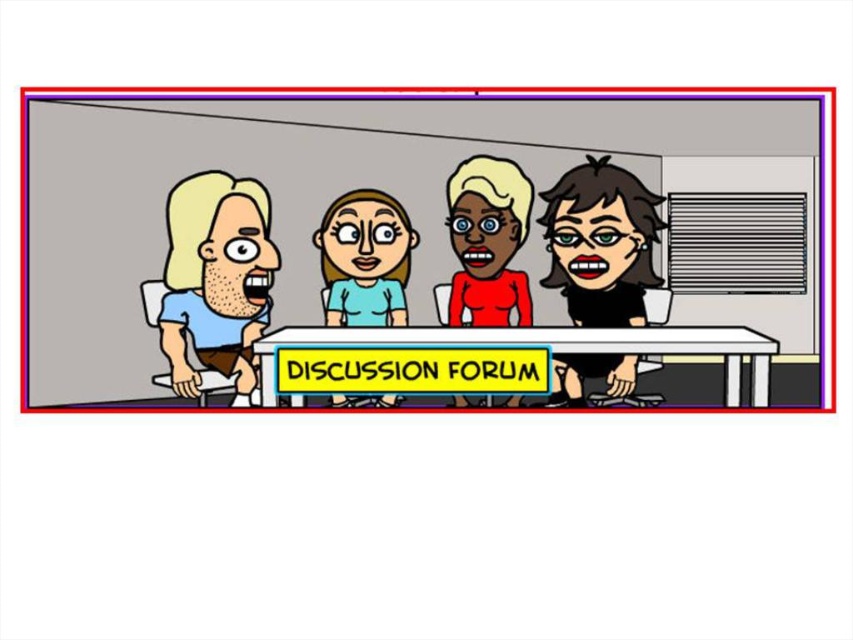
Can you confirm if matte black hair at center is positioned to the left of smooth red dress at center?

No, matte black hair at center is not to the left of smooth red dress at center.

Between matte black hair at center and smooth red dress at center, which one has less height?

Standing shorter between the two is smooth red dress at center.

In order to click on matte black hair at center in this screenshot , I will do `click(601, 243)`.

Who is lower down, matte blue shirt at left or light blue fabric shirt at center?

Positioned lower is matte blue shirt at left.

This screenshot has height=640, width=853. What are the coordinates of `matte blue shirt at left` in the screenshot? It's located at (216, 280).

Identify the location of matte blue shirt at left. Image resolution: width=853 pixels, height=640 pixels. (216, 280).

Image resolution: width=853 pixels, height=640 pixels. In order to click on matte blue shirt at left in this screenshot , I will do `click(216, 280)`.

Which is more to the left, matte black laptop at left or smooth red dress at center?

Positioned to the left is matte black laptop at left.

Is matte black laptop at left to the right of smooth red dress at center from the viewer's perspective?

In fact, matte black laptop at left is to the left of smooth red dress at center.

Does point (694, 284) lie in front of point (480, 273)?

No, (694, 284) is further to viewer.

I want to click on matte black laptop at left, so click(x=426, y=248).